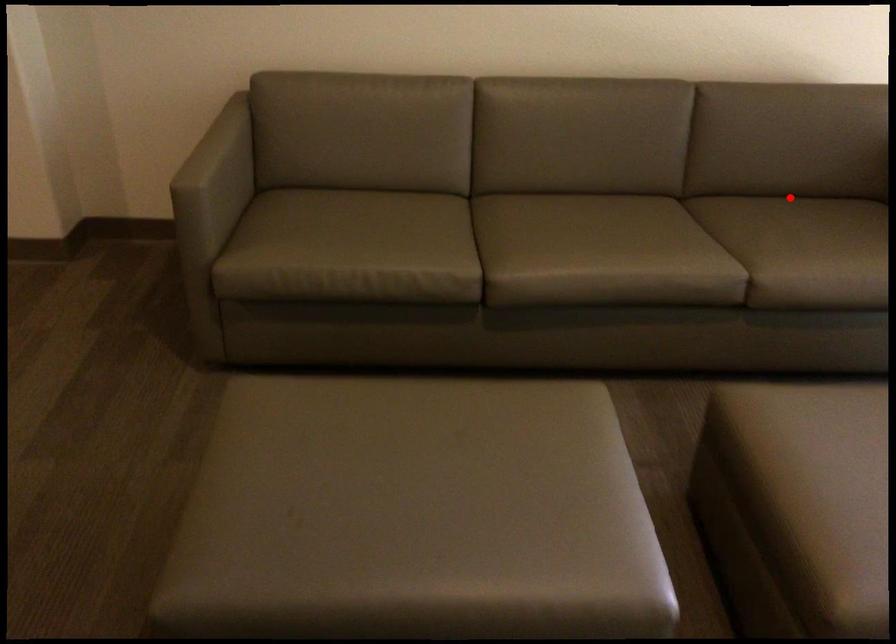
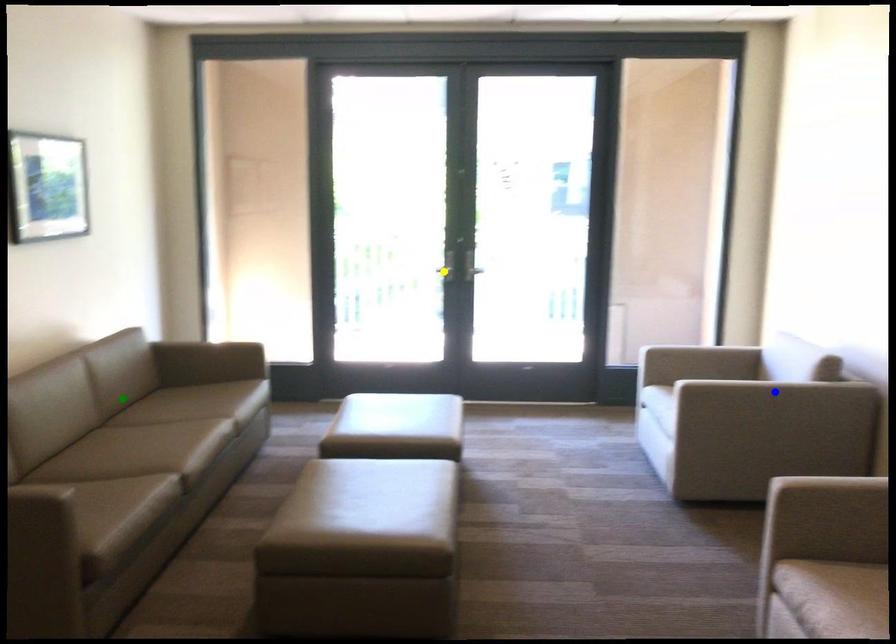
Question: I am providing you with two images of the same scene from different viewpoints. A red point is marked on the first image. You are given multiple points on the second image. Which mark in image 2 goes with the point in image 1?

Choices:
 (A) green point
 (B) blue point
 (C) yellow point

Answer: (A)